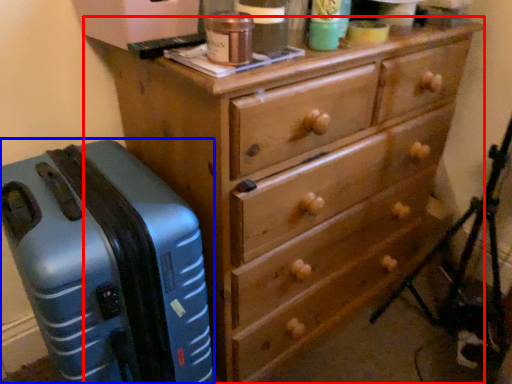
Question: Which object is closer to the camera taking this photo, chest of drawers (highlighted by a red box) or suitcase (highlighted by a blue box)?

Choices:
 (A) chest of drawers
 (B) suitcase

Answer: (B)